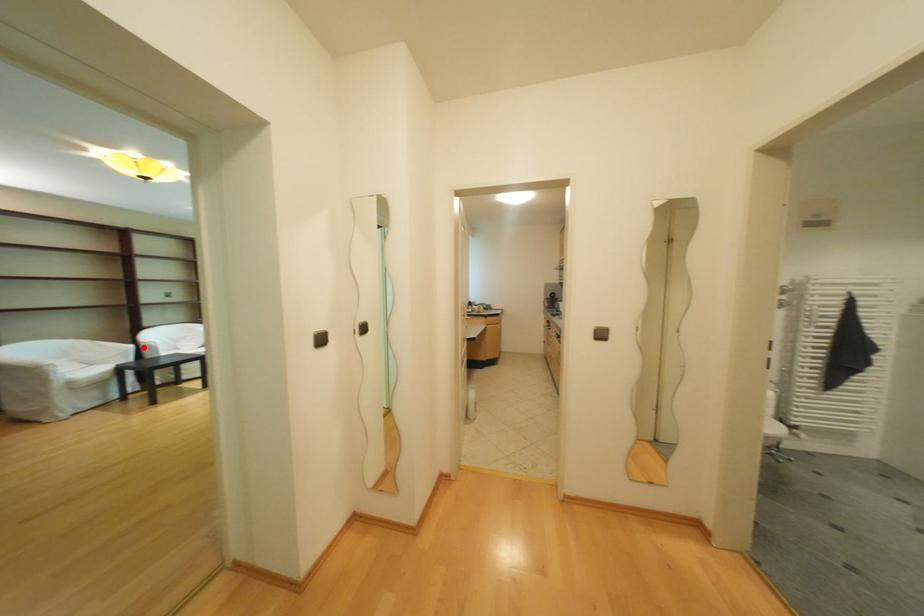
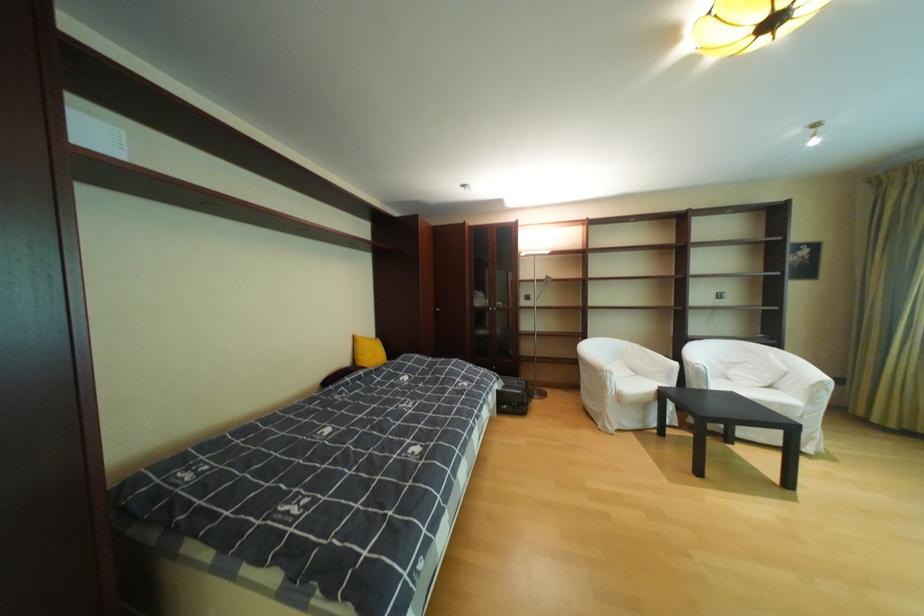
The point at the highlighted location is marked in the first image. Where is the corresponding point in the second image?

(687, 365)